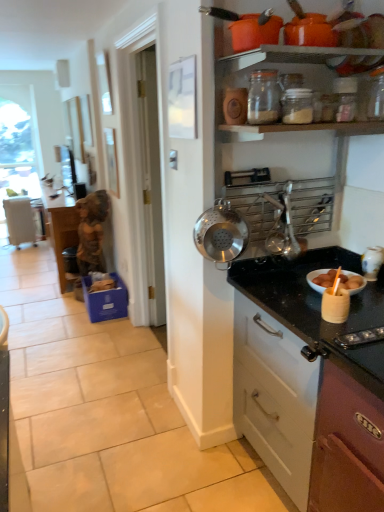
Identify the location of clear glass jar at upper center, arranged as the 1th kitchen appliance when viewed from the top. The image size is (384, 512). (263, 97).

How much space does clear glass jar at upper center, arranged as the 1th kitchen appliance when viewed from the top, occupy horizontally?

clear glass jar at upper center, arranged as the 1th kitchen appliance when viewed from the top, is 11.40 centimeters in width.

Describe the element at coordinates (221, 233) in the screenshot. I see `stainless steel colander at upper right, which appears as the first kitchen appliance when ordered from the bottom` at that location.

Locate an element on the screen. The width and height of the screenshot is (384, 512). stainless steel colander at upper right, arranged as the 3th kitchen appliance when viewed from the top is located at coordinates (221, 233).

What is the approximate height of metallic silver utensil rack at upper center?

The height of metallic silver utensil rack at upper center is 97.94 centimeters.

Locate an element on the screen. The width and height of the screenshot is (384, 512). clear glass jar at upper center, arranged as the 1th kitchen appliance when viewed from the top is located at coordinates (263, 97).

From the image's perspective, is white ceramic jar at right above stainless steel colander at upper right, arranged as the 3th kitchen appliance when viewed from the top?

No, from the image's perspective, white ceramic jar at right is not on top of stainless steel colander at upper right, arranged as the 3th kitchen appliance when viewed from the top.

Is white ceramic jar at right looking in the opposite direction of stainless steel colander at upper right, arranged as the 3th kitchen appliance when viewed from the top?

No.

Is white ceramic jar at right not close to stainless steel colander at upper right, which appears as the first kitchen appliance when ordered from the bottom?

white ceramic jar at right is near stainless steel colander at upper right, which appears as the first kitchen appliance when ordered from the bottom, not far away.

In the image, is white ceramic jar at right positioned in front of or behind stainless steel colander at upper right, which appears as the first kitchen appliance when ordered from the bottom?

Clearly, white ceramic jar at right is behind stainless steel colander at upper right, which appears as the first kitchen appliance when ordered from the bottom.

From the image's perspective, is black granite countertop at right located beneath white ceramic jar at right?

Indeed, from the image's perspective, black granite countertop at right is shown beneath white ceramic jar at right.

Could white ceramic jar at right be considered to be inside black granite countertop at right?

Yes, white ceramic jar at right is inside black granite countertop at right.

Considering the relative sizes of black granite countertop at right and white ceramic jar at right in the image provided, is black granite countertop at right thinner than white ceramic jar at right?

In fact, black granite countertop at right might be wider than white ceramic jar at right.

In the image, is black granite countertop at right positioned in front of or behind white ceramic jar at right?

In the image, black granite countertop at right appears in front of white ceramic jar at right.

From the image's perspective, does clear glass jar at upper center, arranged as the 1th kitchen appliance when viewed from the top, appear lower than clear glass jar at upper center, which is the second kitchen appliance from top to bottom?

No, from the image's perspective, clear glass jar at upper center, arranged as the 1th kitchen appliance when viewed from the top, is not beneath clear glass jar at upper center, which is the second kitchen appliance from top to bottom.

Does point (260, 90) come closer to viewer compared to point (288, 121)?

That is False.

Is there a large distance between clear glass jar at upper center, which is the third kitchen appliance in bottom-to-top order, and clear glass jar at upper center, positioned as the second kitchen appliance in bottom-to-top order?

That's not correct — clear glass jar at upper center, which is the third kitchen appliance in bottom-to-top order, is a little close to clear glass jar at upper center, positioned as the second kitchen appliance in bottom-to-top order.

In terms of size, does black granite countertop at right appear bigger or smaller than clear glass jar at upper center, positioned as the second kitchen appliance in bottom-to-top order?

Clearly, black granite countertop at right is larger in size than clear glass jar at upper center, positioned as the second kitchen appliance in bottom-to-top order.

Could clear glass jar at upper center, positioned as the second kitchen appliance in bottom-to-top order, be considered to be inside black granite countertop at right?

No.

Are black granite countertop at right and clear glass jar at upper center, positioned as the second kitchen appliance in bottom-to-top order, making contact?

There is a gap between black granite countertop at right and clear glass jar at upper center, positioned as the second kitchen appliance in bottom-to-top order.

From the picture: Can you confirm if black granite countertop at right is wider than clear glass jar at upper center, positioned as the second kitchen appliance in bottom-to-top order?

Yes, black granite countertop at right is wider than clear glass jar at upper center, positioned as the second kitchen appliance in bottom-to-top order.

Considering the points (284, 99) and (225, 201), which point is in front, point (284, 99) or point (225, 201)?

The point (284, 99) is in front.

Considering the relative positions of clear glass jar at upper center, positioned as the second kitchen appliance in bottom-to-top order, and stainless steel colander at upper right, arranged as the 3th kitchen appliance when viewed from the top, in the image provided, is clear glass jar at upper center, positioned as the second kitchen appliance in bottom-to-top order, to the left or to the right of stainless steel colander at upper right, arranged as the 3th kitchen appliance when viewed from the top,?

Clearly, clear glass jar at upper center, positioned as the second kitchen appliance in bottom-to-top order, is on the right of stainless steel colander at upper right, arranged as the 3th kitchen appliance when viewed from the top, in the image.

Is clear glass jar at upper center, positioned as the second kitchen appliance in bottom-to-top order, surrounding stainless steel colander at upper right, arranged as the 3th kitchen appliance when viewed from the top?

No.

From the image's perspective, count 2nd kitchen appliances upward from the white ceramic jar at right and point to it. Please provide its 2D coordinates.

[(297, 106)]

From the image's perspective, is clear glass jar at upper center, which is the second kitchen appliance from top to bottom, positioned above or below white ceramic jar at right?

clear glass jar at upper center, which is the second kitchen appliance from top to bottom, is situated higher than white ceramic jar at right in the image.

Considering the sizes of clear glass jar at upper center, which is the second kitchen appliance from top to bottom, and white ceramic jar at right in the image, is clear glass jar at upper center, which is the second kitchen appliance from top to bottom, taller or shorter than white ceramic jar at right?

In the image, clear glass jar at upper center, which is the second kitchen appliance from top to bottom, appears to be shorter than white ceramic jar at right.

In the scene shown: Does clear glass jar at upper center, positioned as the second kitchen appliance in bottom-to-top order, touch white ceramic jar at right?

No, clear glass jar at upper center, positioned as the second kitchen appliance in bottom-to-top order, is not making contact with white ceramic jar at right.

From a real-world perspective, which is physically below, metallic silver utensil rack at upper center or stainless steel colander at upper right, which appears as the first kitchen appliance when ordered from the bottom?

stainless steel colander at upper right, which appears as the first kitchen appliance when ordered from the bottom, from a real-world perspective.

Does metallic silver utensil rack at upper center come in front of stainless steel colander at upper right, which appears as the first kitchen appliance when ordered from the bottom?

→ Yes, the depth of metallic silver utensil rack at upper center is less than that of stainless steel colander at upper right, which appears as the first kitchen appliance when ordered from the bottom.

Based on the photo, is metallic silver utensil rack at upper center positioned with its back to stainless steel colander at upper right, which appears as the first kitchen appliance when ordered from the bottom?

Absolutely, metallic silver utensil rack at upper center is directed away from stainless steel colander at upper right, which appears as the first kitchen appliance when ordered from the bottom.

Measure the distance from metallic silver utensil rack at upper center to stainless steel colander at upper right, which appears as the first kitchen appliance when ordered from the bottom.

metallic silver utensil rack at upper center and stainless steel colander at upper right, which appears as the first kitchen appliance when ordered from the bottom, are 15.03 inches apart.

Identify the location of the 1st kitchen appliance above the white ceramic jar at right (from the image's perspective). (221, 233).

The width and height of the screenshot is (384, 512). In the image, there is a white ceramic jar at right. In order to click on countertop below it (from a real-world perspective) in this screenshot , I will do `click(310, 382)`.

Based on their spatial positions, is clear glass jar at upper center, which is the third kitchen appliance in bottom-to-top order, or white ceramic jar at right closer to black granite countertop at right?

The object closer to black granite countertop at right is white ceramic jar at right.

Considering their positions, is metallic silver utensil rack at upper center positioned further to stainless steel colander at upper right, arranged as the 3th kitchen appliance when viewed from the top, than white ceramic jar at right?

white ceramic jar at right lies further to stainless steel colander at upper right, arranged as the 3th kitchen appliance when viewed from the top, than the other object.

Estimate the real-world distances between objects in this image. Which object is closer to clear glass jar at upper center, arranged as the 1th kitchen appliance when viewed from the top, black granite countertop at right or stainless steel colander at upper right, which appears as the first kitchen appliance when ordered from the bottom?

Among the two, stainless steel colander at upper right, which appears as the first kitchen appliance when ordered from the bottom, is located nearer to clear glass jar at upper center, arranged as the 1th kitchen appliance when viewed from the top.

Estimate the real-world distances between objects in this image. Which object is closer to metallic silver utensil rack at upper center, stainless steel colander at upper right, arranged as the 3th kitchen appliance when viewed from the top, or clear glass jar at upper center, which is the second kitchen appliance from top to bottom?

Among the two, stainless steel colander at upper right, arranged as the 3th kitchen appliance when viewed from the top, is located nearer to metallic silver utensil rack at upper center.

From the image, which object appears to be farther from clear glass jar at upper center, arranged as the 1th kitchen appliance when viewed from the top, white ceramic jar at right or metallic silver utensil rack at upper center?

Based on the image, white ceramic jar at right appears to be further to clear glass jar at upper center, arranged as the 1th kitchen appliance when viewed from the top.

Considering their positions, is white ceramic jar at right positioned further to black granite countertop at right than clear glass jar at upper center, which is the third kitchen appliance in bottom-to-top order?

clear glass jar at upper center, which is the third kitchen appliance in bottom-to-top order, is further to black granite countertop at right.

From the image, which object appears to be nearer to metallic silver utensil rack at upper center, black granite countertop at right or clear glass jar at upper center, which is the second kitchen appliance from top to bottom?

Based on the image, black granite countertop at right appears to be nearer to metallic silver utensil rack at upper center.

From the image, which object appears to be nearer to white ceramic jar at right, clear glass jar at upper center, which is the second kitchen appliance from top to bottom, or stainless steel colander at upper right, which appears as the first kitchen appliance when ordered from the bottom?

stainless steel colander at upper right, which appears as the first kitchen appliance when ordered from the bottom, is positioned closer to the anchor white ceramic jar at right.

Where is `dresser that lies between clear glass jar at upper center, which is the second kitchen appliance from top to bottom, and stainless steel colander at upper right, arranged as the 3th kitchen appliance when viewed from the top, from top to bottom`? The width and height of the screenshot is (384, 512). dresser that lies between clear glass jar at upper center, which is the second kitchen appliance from top to bottom, and stainless steel colander at upper right, arranged as the 3th kitchen appliance when viewed from the top, from top to bottom is located at coordinates (303, 283).

In order to click on dresser between clear glass jar at upper center, which is the third kitchen appliance in bottom-to-top order, and stainless steel colander at upper right, arranged as the 3th kitchen appliance when viewed from the top, in the vertical direction in this screenshot , I will do `click(303, 283)`.

I want to click on appliance between clear glass jar at upper center, positioned as the second kitchen appliance in bottom-to-top order, and black granite countertop at right, in the vertical direction, so click(x=372, y=262).

Locate an element on the screen. This screenshot has width=384, height=512. appliance that lies between metallic silver utensil rack at upper center and black granite countertop at right from top to bottom is located at coordinates (372, 262).